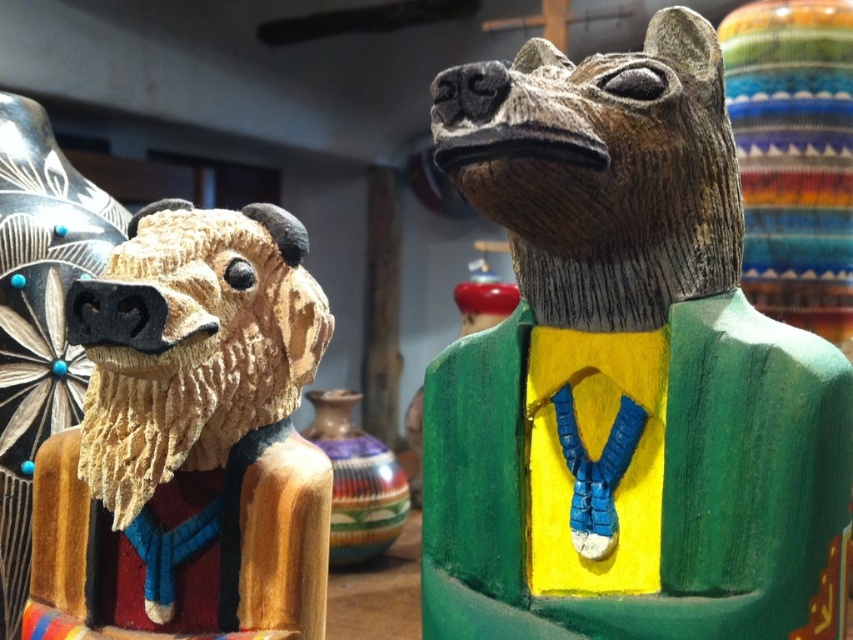
Does wooden statue at right appear on the left side of wooden bear head at left?

Incorrect, wooden statue at right is not on the left side of wooden bear head at left.

Between wooden statue at right and wooden bear head at left, which one has less height?

wooden bear head at left is shorter.

You are a GUI agent. You are given a task and a screenshot of the screen. Output one action in this format:
    pyautogui.click(x=<x>, y=<y>)
    Task: Click on the wooden statue at right
    
    Given the screenshot: What is the action you would take?
    pyautogui.click(x=624, y=371)

Does wooden statue at right lie behind multicolored clay vase at center?

No, wooden statue at right is closer to the viewer.

Is wooden statue at right to the right of multicolored clay vase at center from the viewer's perspective?

Yes, wooden statue at right is to the right of multicolored clay vase at center.

Looking at this image, who is more forward, (514,138) or (323,444)?

Point (514,138) is in front.

At what (x,y) coordinates should I click in order to perform the action: click on wooden statue at right. Please return your answer as a coordinate pair (x, y). Image resolution: width=853 pixels, height=640 pixels. Looking at the image, I should click on (624, 371).

Is point (103, 435) positioned after point (334, 396)?

No.

At what (x,y) coordinates should I click in order to perform the action: click on wooden bear head at left. Please return your answer as a coordinate pair (x, y). The image size is (853, 640). Looking at the image, I should click on (189, 440).